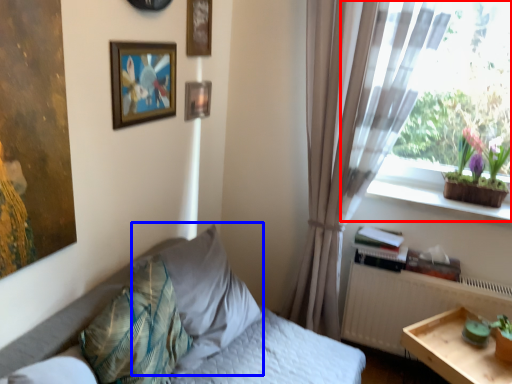
Question: Which object is closer to the camera taking this photo, window (highlighted by a red box) or pillow (highlighted by a blue box)?

Choices:
 (A) window
 (B) pillow

Answer: (B)